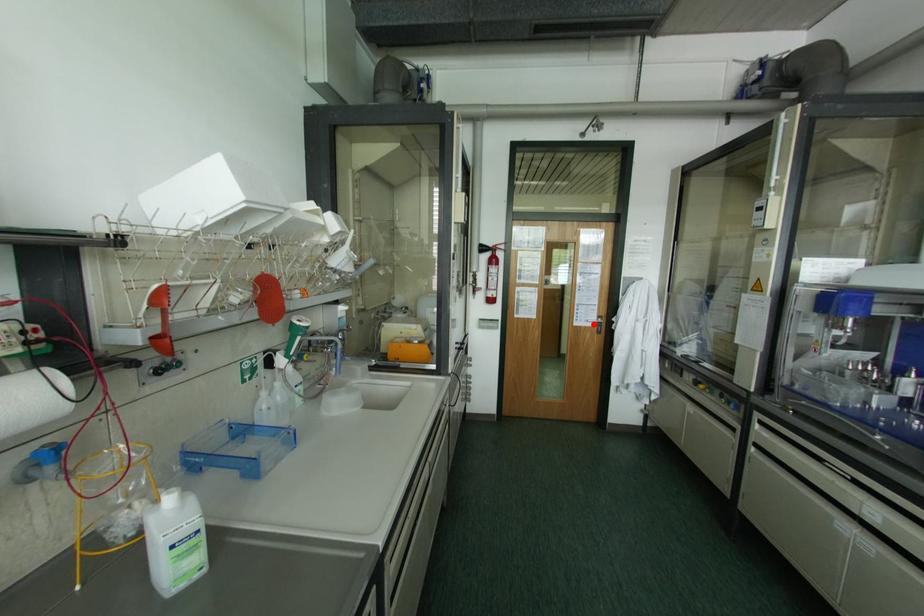
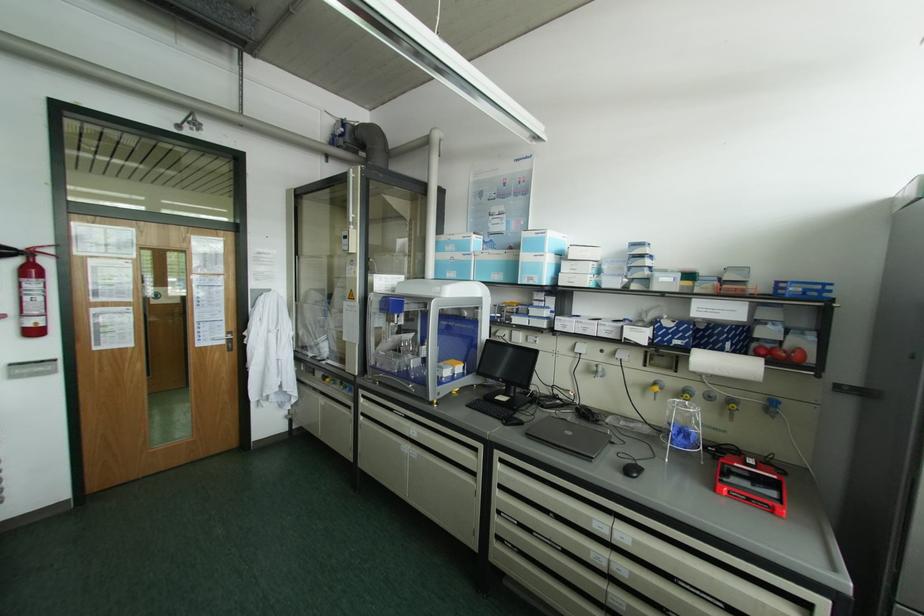
The point at the highlighted location is marked in the first image. Where is the corresponding point in the second image?

(224, 342)